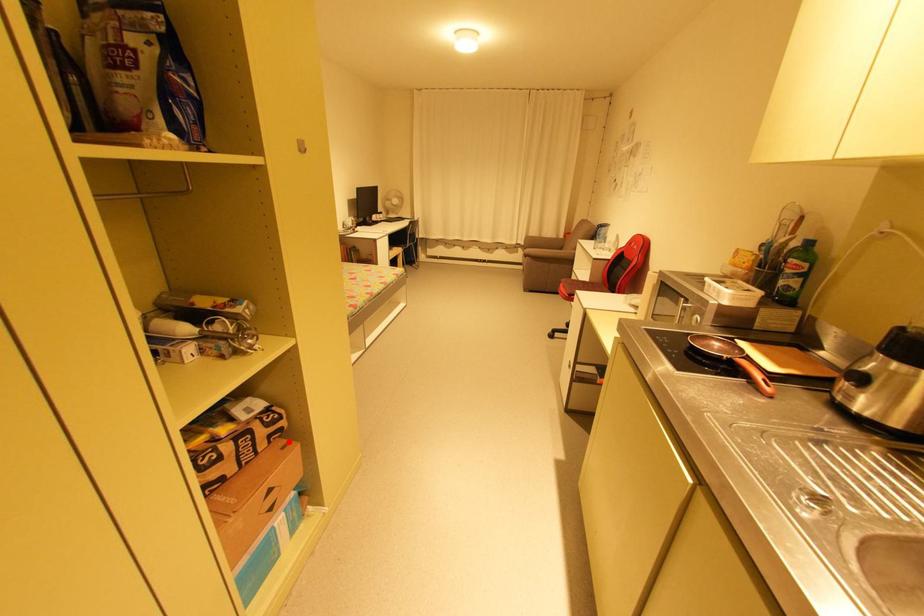
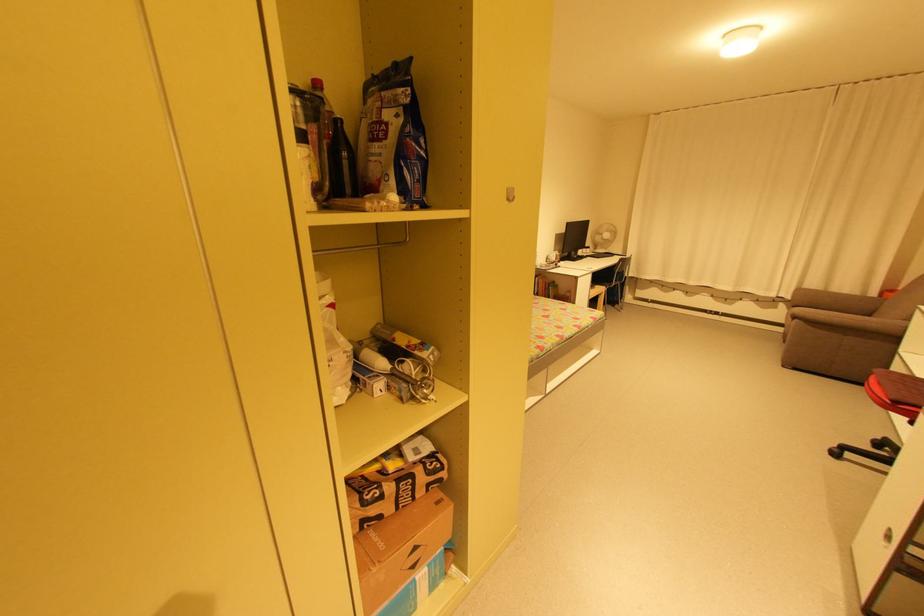
Find the pixel in the second image that matches the highlighted location in the first image.

(445, 495)